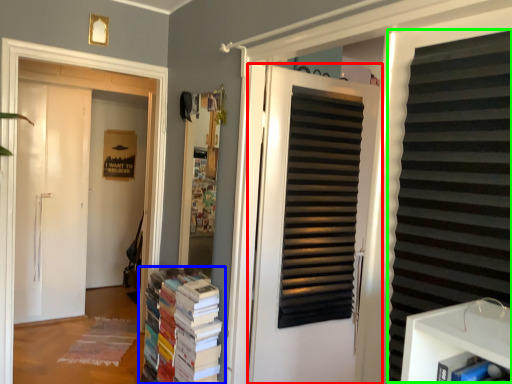
Question: Which object is positioned closest to door (highlighted by a red box)? Select from book (highlighted by a blue box) and shutter (highlighted by a green box).

Choices:
 (A) book
 (B) shutter

Answer: (A)